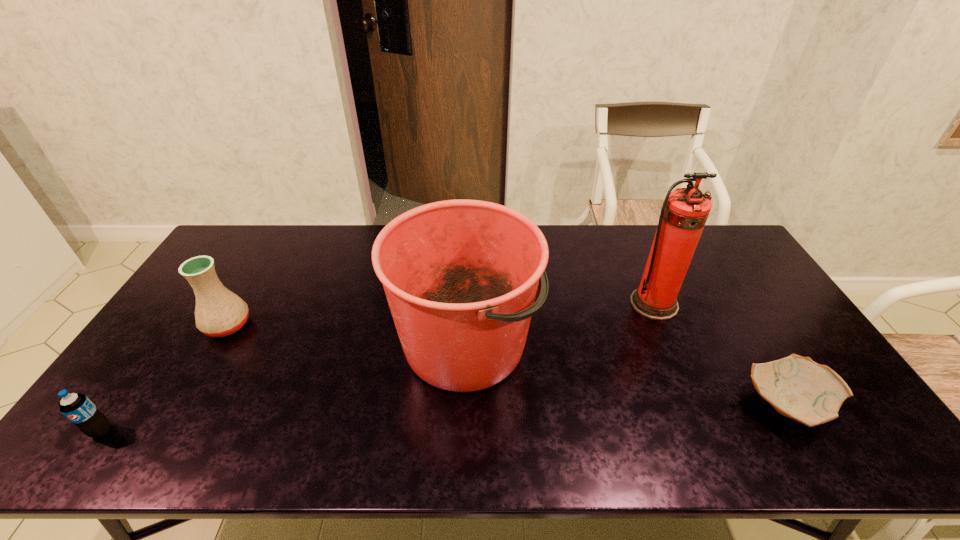
You are a GUI agent. You are given a task and a screenshot of the screen. Output one action in this format:
    pyautogui.click(x=<x>, y=<y>)
    Task: Click on the vacant space situated 0.230m at the discharge end of the fire extinguisher
    
    Given the screenshot: What is the action you would take?
    pyautogui.click(x=688, y=384)

What are the coordinates of `vacant space located 0.140m on the back of the second tallest object` in the screenshot? It's located at (468, 262).

The image size is (960, 540). I want to click on free location located 0.180m on the back of the left pottery, so click(x=259, y=271).

Image resolution: width=960 pixels, height=540 pixels. What are the coordinates of `vacant area situated 0.090m on the back of the leftmost object` in the screenshot? It's located at (130, 390).

At what (x,y) coordinates should I click in order to perform the action: click on free space located on the left of the rightmost object. Please return your answer as a coordinate pair (x, y). The height and width of the screenshot is (540, 960). Looking at the image, I should click on point(627,406).

In order to click on soda bottle that is at the near edge in this screenshot , I will do `click(78, 408)`.

Locate an element on the screen. The image size is (960, 540). pottery at the near edge is located at coordinates (797, 387).

This screenshot has width=960, height=540. Identify the location of pottery that is positioned at the left edge. (219, 312).

At what (x,y) coordinates should I click in order to perform the action: click on soda bottle at the left edge. Please return your answer as a coordinate pair (x, y). This screenshot has width=960, height=540. Looking at the image, I should click on (78, 408).

The width and height of the screenshot is (960, 540). I want to click on object at the right edge, so click(x=797, y=387).